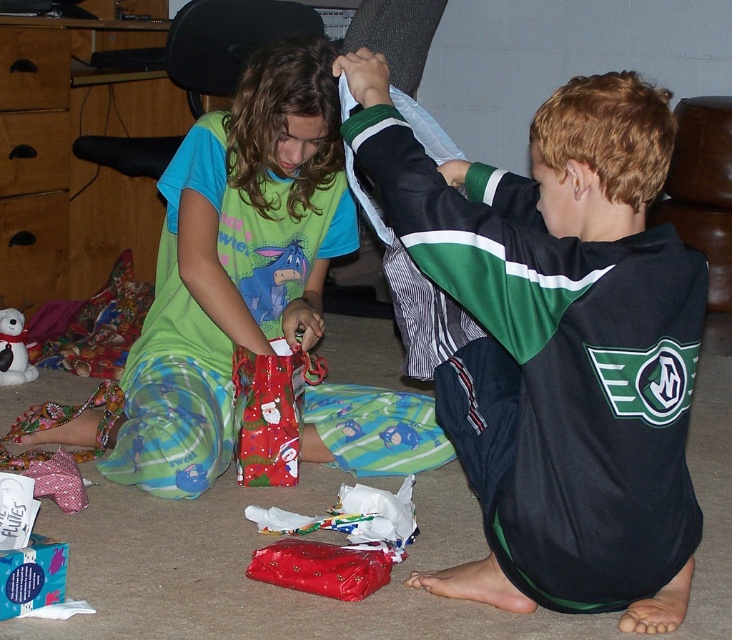
Image resolution: width=732 pixels, height=640 pixels. In order to click on shiny metallic gift bag at lower left in this screenshot , I will do `click(31, 576)`.

Is shiny metallic gift bag at lower left thinner than white matte teddy bear at lower left?

No, shiny metallic gift bag at lower left is not thinner than white matte teddy bear at lower left.

At what (x,y) coordinates should I click in order to perform the action: click on shiny metallic gift bag at lower left. Please return your answer as a coordinate pair (x, y). Looking at the image, I should click on (31, 576).

This screenshot has height=640, width=732. Identify the location of shiny metallic gift bag at lower left. (31, 576).

Between matte green pajama pants at center and shiny metallic gift bag at lower left, which one appears on the right side from the viewer's perspective?

From the viewer's perspective, matte green pajama pants at center appears more on the right side.

Between point (362, 419) and point (45, 564), which one is positioned in front?

Positioned in front is point (45, 564).

The width and height of the screenshot is (732, 640). What are the coordinates of `matte green pajama pants at center` in the screenshot? It's located at (234, 264).

At what (x,y) coordinates should I click in order to perform the action: click on matte green pajama pants at center. Please return your answer as a coordinate pair (x, y). This screenshot has height=640, width=732. Looking at the image, I should click on (234, 264).

Is point (269, 344) farther from camera compared to point (0, 324)?

No.

Between point (246, 428) and point (1, 380), which one is positioned in front?

Point (246, 428) is in front.

You are a GUI agent. You are given a task and a screenshot of the screen. Output one action in this format:
    pyautogui.click(x=<x>, y=<y>)
    Task: Click on the shiny red fabric gift bag at lower center
    This screenshot has height=640, width=732.
    Given the screenshot: What is the action you would take?
    pyautogui.click(x=266, y=413)

I want to click on shiny red fabric gift bag at lower center, so click(266, 413).